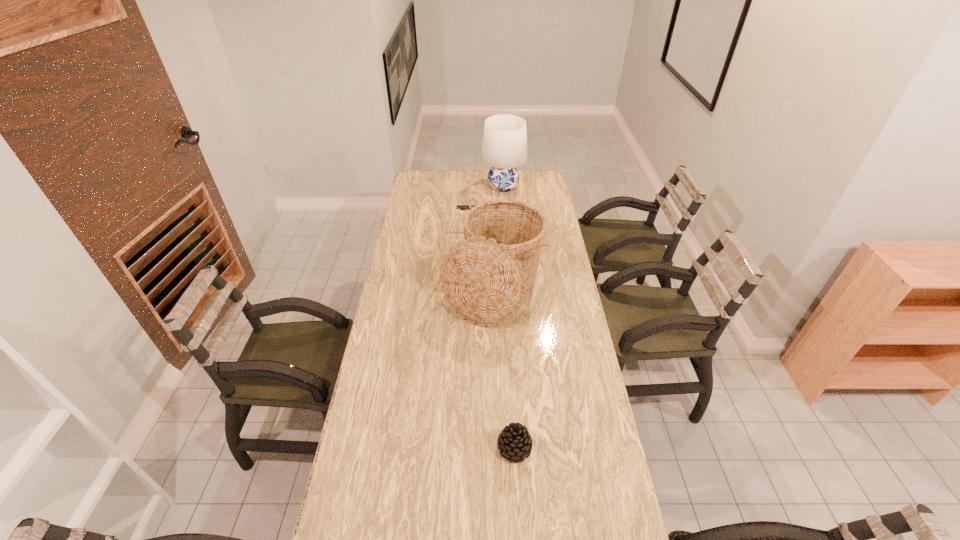
Locate an element on the screen. This screenshot has width=960, height=540. the farthest object is located at coordinates (504, 147).

This screenshot has height=540, width=960. Find the location of `the second nearest object`. the second nearest object is located at coordinates (484, 278).

You are a GUI agent. You are given a task and a screenshot of the screen. Output one action in this format:
    pyautogui.click(x=<x>, y=<y>)
    Task: Click on the third nearest object
    The height and width of the screenshot is (540, 960).
    Given the screenshot: What is the action you would take?
    pyautogui.click(x=463, y=207)

Image resolution: width=960 pixels, height=540 pixels. In order to click on pinecone in this screenshot , I will do `click(514, 442)`.

Locate an element on the screen. vacant region located on the front-facing side of the farthest object is located at coordinates (420, 186).

What are the coordinates of `free region located 0.270m on the front-facing side of the farthest object` in the screenshot? It's located at (432, 186).

Where is `free region located on the front-facing side of the farthest object`? free region located on the front-facing side of the farthest object is located at coordinates (437, 186).

The image size is (960, 540). Find the location of `vacant point located 0.090m on the back of the basket`. vacant point located 0.090m on the back of the basket is located at coordinates (491, 238).

At what (x,y) coordinates should I click in order to perform the action: click on vacant region located 0.120m along the barrel of the gun. Please return your answer as a coordinate pair (x, y). Looking at the image, I should click on (432, 226).

You are a GUI agent. You are given a task and a screenshot of the screen. Output one action in this format:
    pyautogui.click(x=<x>, y=<y>)
    Task: Click on the free space located 0.220m along the barrel of the gun
    
    Given the screenshot: What is the action you would take?
    pyautogui.click(x=412, y=226)